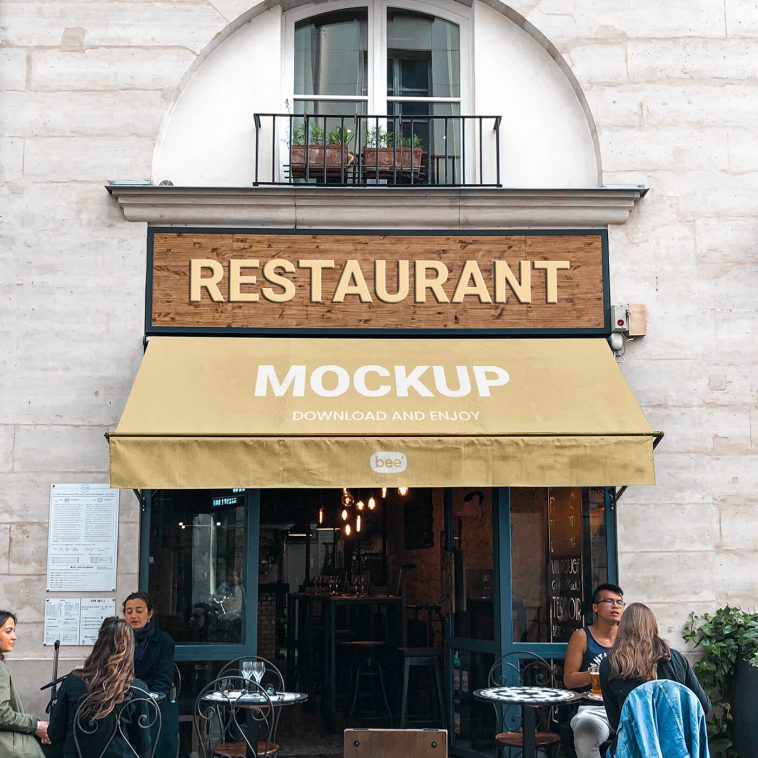
Find the location of a particular element. lights is located at coordinates (395, 484), (370, 500), (362, 520), (346, 525), (343, 514).